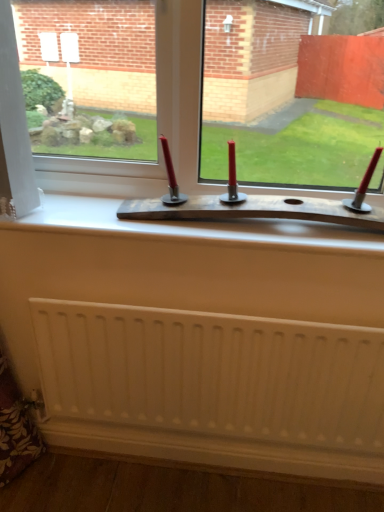
At what (x,y) coordinates should I click in order to perform the action: click on vacant region above white matte radiator at lower center (from a real-world perspective). Please return your answer as a coordinate pair (x, y). The height and width of the screenshot is (512, 384). Looking at the image, I should click on pyautogui.click(x=223, y=315).